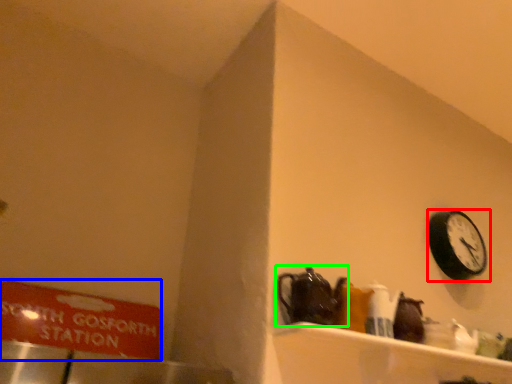
Question: Which object is positioned closest to wall clock (highlighted by a red box)? Select from sign (highlighted by a blue box) and tea pot (highlighted by a green box).

Choices:
 (A) sign
 (B) tea pot

Answer: (B)